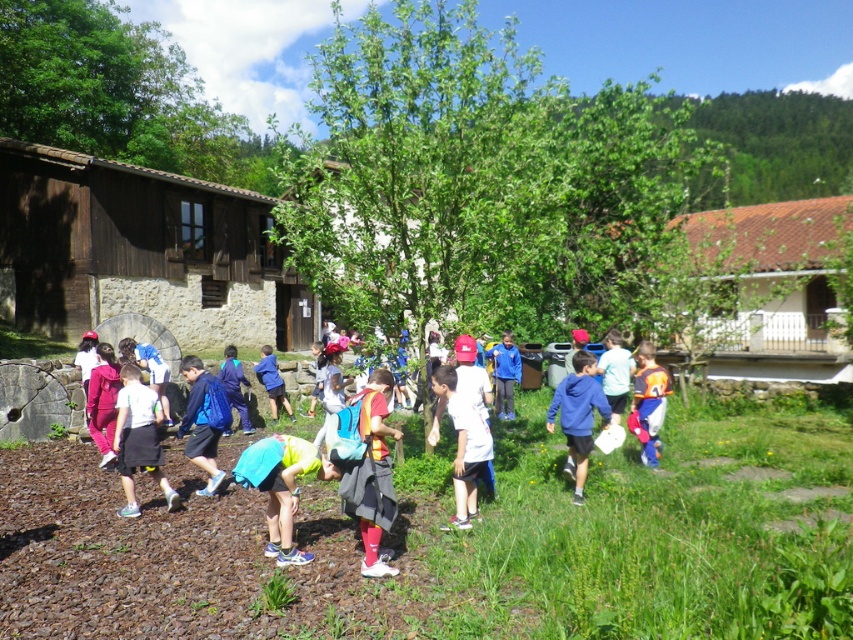
Is white matte shorts at lower left shorter than orange fabric backpack at right?

Correct, white matte shorts at lower left is not as tall as orange fabric backpack at right.

Who is taller, white matte shorts at lower left or orange fabric backpack at right?

Standing taller between the two is orange fabric backpack at right.

I want to click on white matte shorts at lower left, so click(x=138, y=440).

Which is more to the right, white matte shirt at center or orange fabric backpack at right?

Positioned to the right is orange fabric backpack at right.

Locate an element on the screen. This screenshot has height=640, width=853. white matte shirt at center is located at coordinates 463,448.

How distant is light blue fabric at center from orange fabric backpack at right?

They are 5.03 meters apart.

Is light blue fabric at center taller than orange fabric backpack at right?

In fact, light blue fabric at center may be shorter than orange fabric backpack at right.

What do you see at coordinates (281, 486) in the screenshot? I see `light blue fabric at center` at bounding box center [281, 486].

Locate an element on the screen. light blue fabric at center is located at coordinates (281, 486).